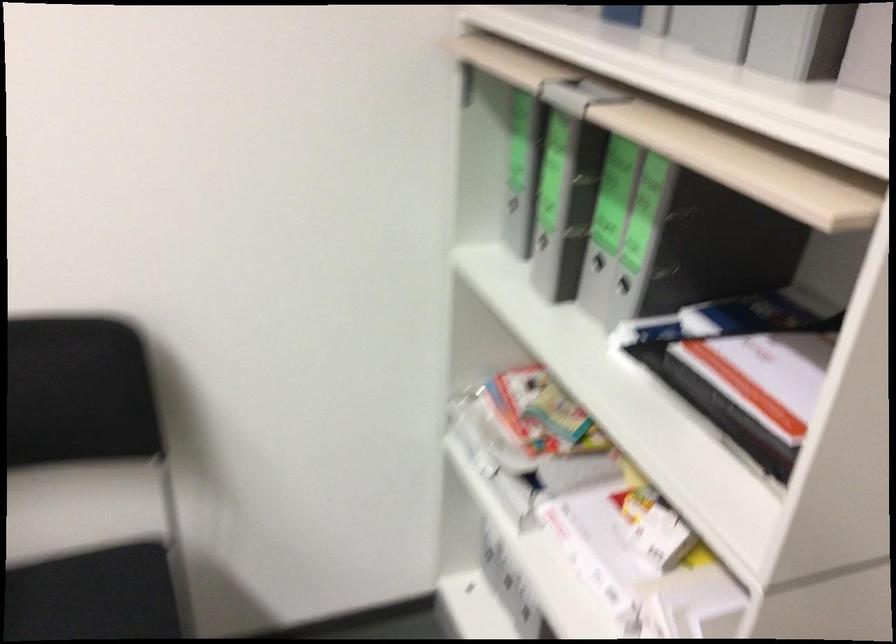
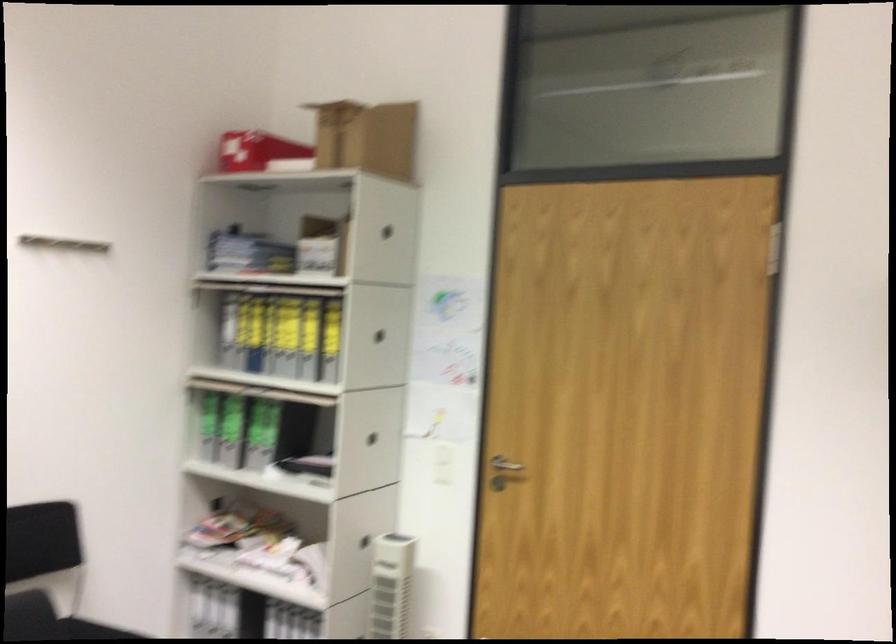
Locate, in the second image, the point that corresponds to point (605, 288) in the first image.

(265, 453)